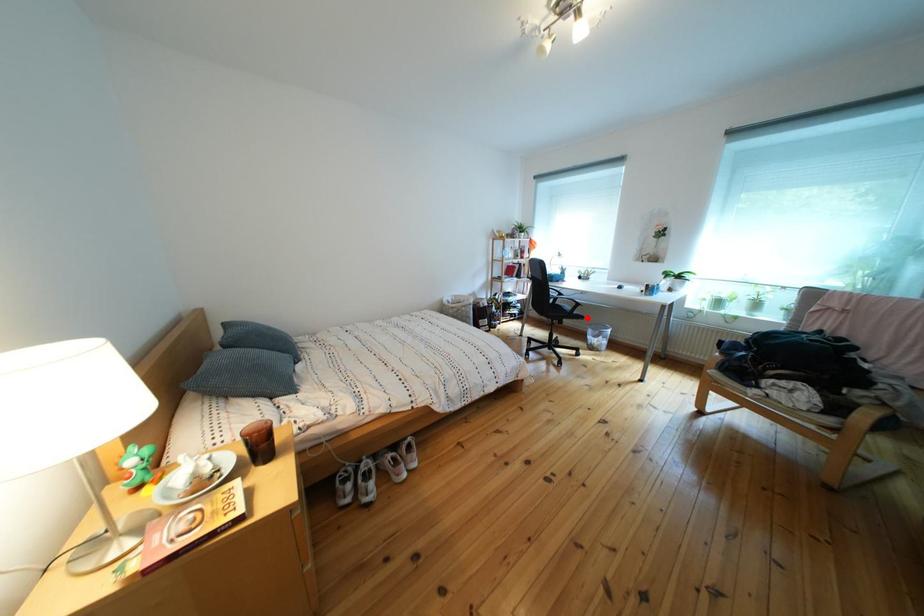
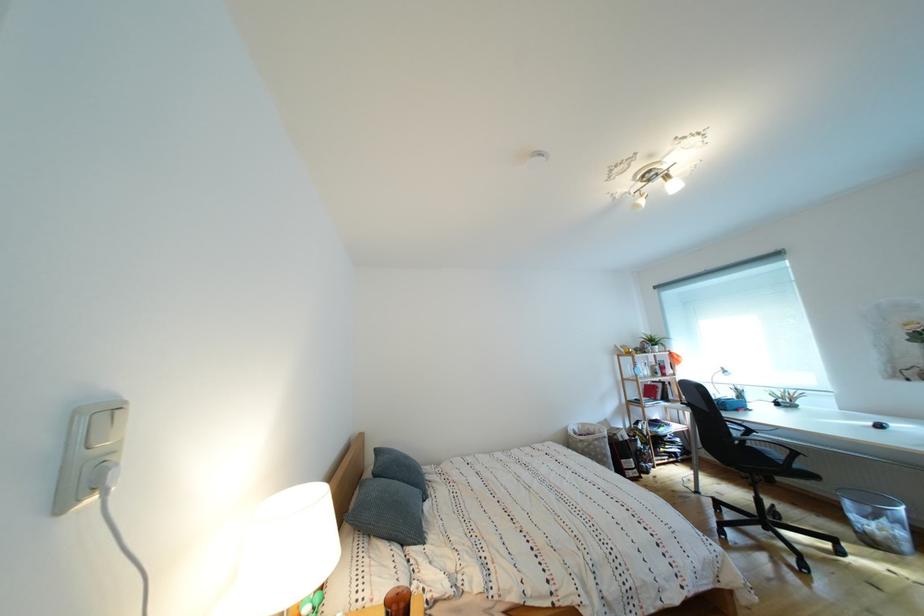
Question: I am providing you with two images of the same scene from different viewpoints. A red point is shown in image1. For the corresponding object point in image2, is it positioned nearer or farther from the camera?

Choices:
 (A) Nearer
 (B) Farther

Answer: (A)